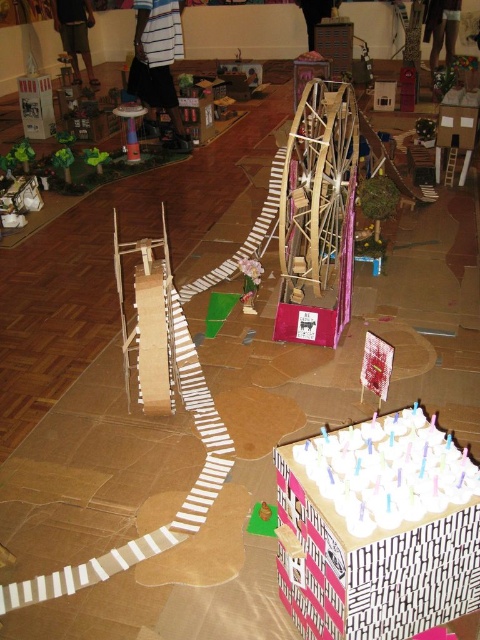
Looking at this image, which of these two, striped fabric shirt at upper center or metallic silver tower at center, stands shorter?

metallic silver tower at center is shorter.

Where is `striped fabric shirt at upper center`? The height and width of the screenshot is (640, 480). striped fabric shirt at upper center is located at coordinates [x=158, y=61].

Measure the distance between striped fabric shirt at upper center and camera.

striped fabric shirt at upper center and camera are 5.58 meters apart.

Where is `striped fabric shirt at upper center`? The height and width of the screenshot is (640, 480). striped fabric shirt at upper center is located at coordinates (158, 61).

Does point (394, 422) come farther from viewer compared to point (129, 160)?

No, it is not.

Is white striped cake at lower right bigger than metallic silver tower at center?

Yes.

Identify the location of white striped cake at lower right. This screenshot has width=480, height=640. (377, 529).

Between white striped cake at lower right and striped fabric shirt at upper center, which one is positioned higher?

striped fabric shirt at upper center is higher up.

Can you confirm if white striped cake at lower right is shorter than striped fabric shirt at upper center?

Indeed, white striped cake at lower right has a lesser height compared to striped fabric shirt at upper center.

Which is in front, point (308, 445) or point (132, 81)?

Point (308, 445)

This screenshot has width=480, height=640. In order to click on white striped cake at lower right in this screenshot , I will do (x=377, y=529).